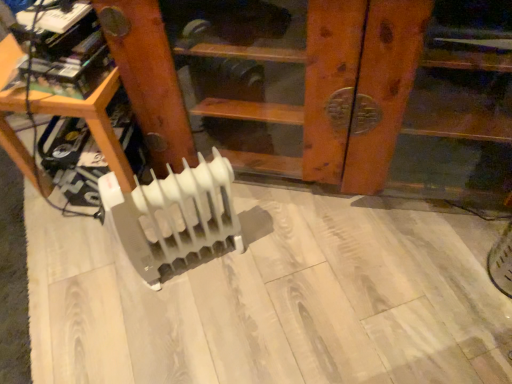
Question: Considering the relative positions of white plastic radiator at center and white plastic radiator at center, which is the 1th furniture from right to left, in the image provided, is white plastic radiator at center to the right of white plastic radiator at center, which is the 1th furniture from right to left, from the viewer's perspective?

Choices:
 (A) no
 (B) yes

Answer: (A)

Question: Does white plastic radiator at center have a greater height compared to white plastic radiator at center, which is the second furniture in left-to-right order?

Choices:
 (A) yes
 (B) no

Answer: (B)

Question: Would you say white plastic radiator at center, which is the second furniture in left-to-right order, is part of white plastic radiator at center's contents?

Choices:
 (A) yes
 (B) no

Answer: (B)

Question: Considering the relative sizes of white plastic radiator at center and white plastic radiator at center, which is the 1th furniture from right to left, in the image provided, is white plastic radiator at center smaller than white plastic radiator at center, which is the 1th furniture from right to left,?

Choices:
 (A) no
 (B) yes

Answer: (B)

Question: From a real-world perspective, does white plastic radiator at center stand above white plastic radiator at center, which is the 1th furniture from right to left?

Choices:
 (A) no
 (B) yes

Answer: (A)

Question: In terms of size, does white plastic radiator at lower center, positioned as the 1th furniture in left-to-right order, appear bigger or smaller than white plastic radiator at center?

Choices:
 (A) small
 (B) big

Answer: (B)

Question: Is white plastic radiator at lower center, which is the 2th furniture from right to left, spatially inside white plastic radiator at center, or outside of it?

Choices:
 (A) outside
 (B) inside

Answer: (A)

Question: Considering the positions of white plastic radiator at lower center, positioned as the 1th furniture in left-to-right order, and white plastic radiator at center in the image, is white plastic radiator at lower center, positioned as the 1th furniture in left-to-right order, taller or shorter than white plastic radiator at center?

Choices:
 (A) short
 (B) tall

Answer: (B)

Question: Looking at their shapes, would you say white plastic radiator at lower center, positioned as the 1th furniture in left-to-right order, is wider or thinner than white plastic radiator at center?

Choices:
 (A) wide
 (B) thin

Answer: (A)

Question: Is white plastic radiator at center inside or outside of white plastic radiator at lower center, which is the 2th furniture from right to left?

Choices:
 (A) inside
 (B) outside

Answer: (B)

Question: From the image's perspective, is white plastic radiator at center positioned above or below white plastic radiator at lower center, positioned as the 1th furniture in left-to-right order?

Choices:
 (A) above
 (B) below

Answer: (B)

Question: Considering the positions of point (148, 279) and point (70, 102), is point (148, 279) closer or farther from the camera than point (70, 102)?

Choices:
 (A) farther
 (B) closer

Answer: (A)

Question: Relative to white plastic radiator at lower center, positioned as the 1th furniture in left-to-right order, is white plastic radiator at center in front or behind?

Choices:
 (A) front
 (B) behind

Answer: (A)

Question: Considering the positions of point (53, 100) and point (163, 127), is point (53, 100) closer or farther from the camera than point (163, 127)?

Choices:
 (A) farther
 (B) closer

Answer: (B)

Question: From the image's perspective, relative to white plastic radiator at center, which is the second furniture in left-to-right order, is white plastic radiator at lower center, positioned as the 1th furniture in left-to-right order, above or below?

Choices:
 (A) above
 (B) below

Answer: (B)